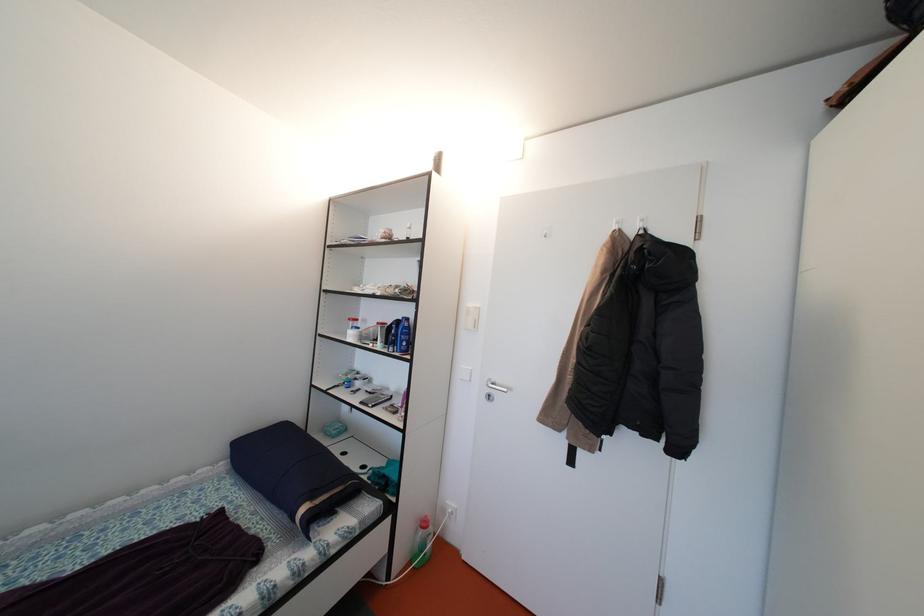
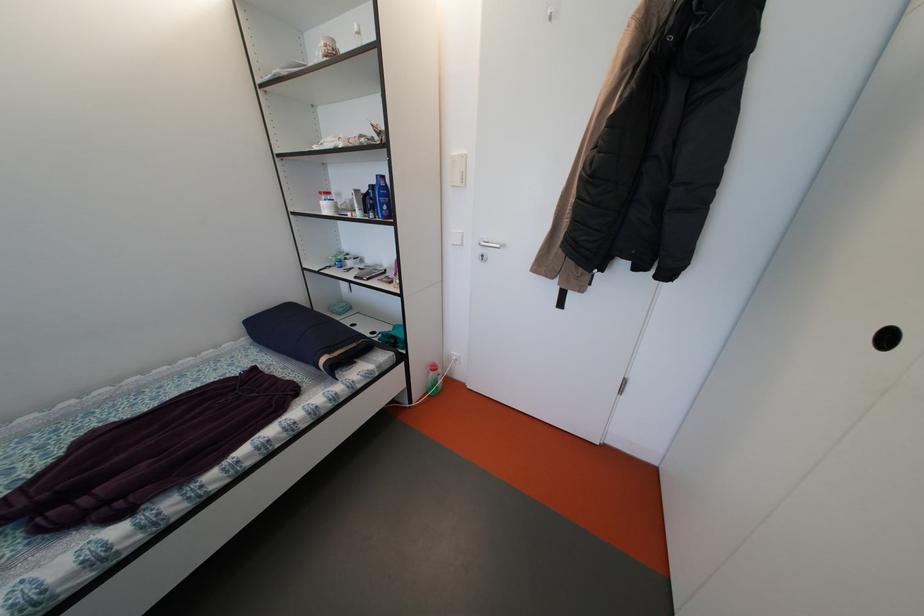
Locate, in the second image, the point that corresponds to [310,515] in the first image.

(331, 365)